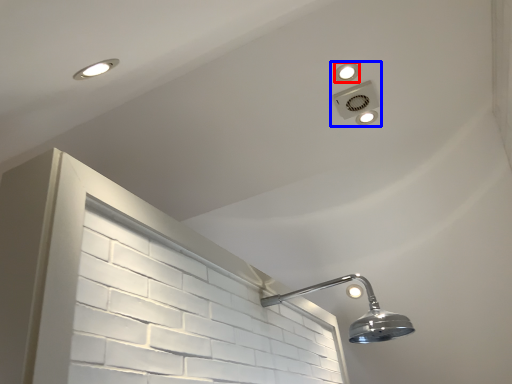
Question: Which object appears farthest to the camera in this image, dot (highlighted by a red box) or fixture (highlighted by a blue box)?

Choices:
 (A) dot
 (B) fixture

Answer: (B)